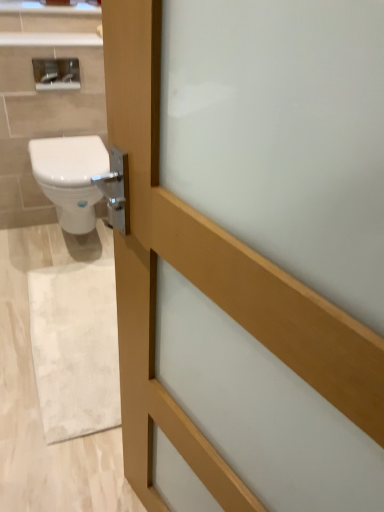
Question: Based on their sizes in the image, would you say satin silver mirror at upper left is bigger or smaller than white marble rug at lower left?

Choices:
 (A) small
 (B) big

Answer: (A)

Question: Visually, is satin silver mirror at upper left positioned to the left or to the right of white marble rug at lower left?

Choices:
 (A) right
 (B) left

Answer: (B)

Question: Estimate the real-world distances between objects in this image. Which object is farther from the white marble rug at lower left?

Choices:
 (A) white glossy bidet at left
 (B) satin silver mirror at upper left

Answer: (B)

Question: Considering the real-world distances, which object is farthest from the satin silver mirror at upper left?

Choices:
 (A) white marble rug at lower left
 (B) white glossy bidet at left

Answer: (A)